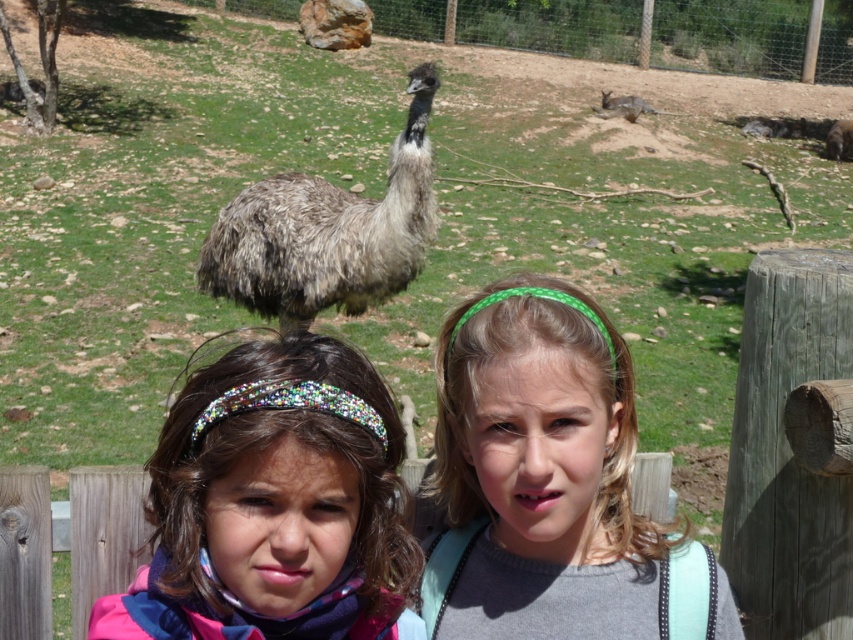
You are a photographer trying to capture a photo of the multicolored sequined headband at center and the fuzzy gray kangaroo at upper right. Based on their positions, which object is located more to the left?

The multicolored sequined headband at center is positioned on the left side of fuzzy gray kangaroo at upper right, so it is more to the left.

You are a photographer trying to capture a photo of the multicolored sequined headband at center and the fuzzy gray wallaby at upper right. Can you see both objects clearly in the frame without any obstruction?

The multicolored sequined headband at center is positioned under the fuzzy gray wallaby at upper right, so the wallaby may block part of the headband, making it difficult to see both clearly without moving the camera angle.

You are a photographer trying to capture a closeup of the multicolored sequined headband at center and the fuzzy gray wallaby at upper right in the same frame. Given that your camera lens can only focus on objects within a 1.2 meter width, can you fit both objects into the frame without moving the camera?

The multicolored sequined headband at center is narrower than the fuzzy gray wallaby at upper right, but the total width of both objects combined may exceed the 1.2 meter limit. However, since the question specifies focusing on both within the frame, it depends on their exact positions and distances. Without specific measurements of their separation, it is uncertain if they can both fit within the 1.2 meter width constraint.